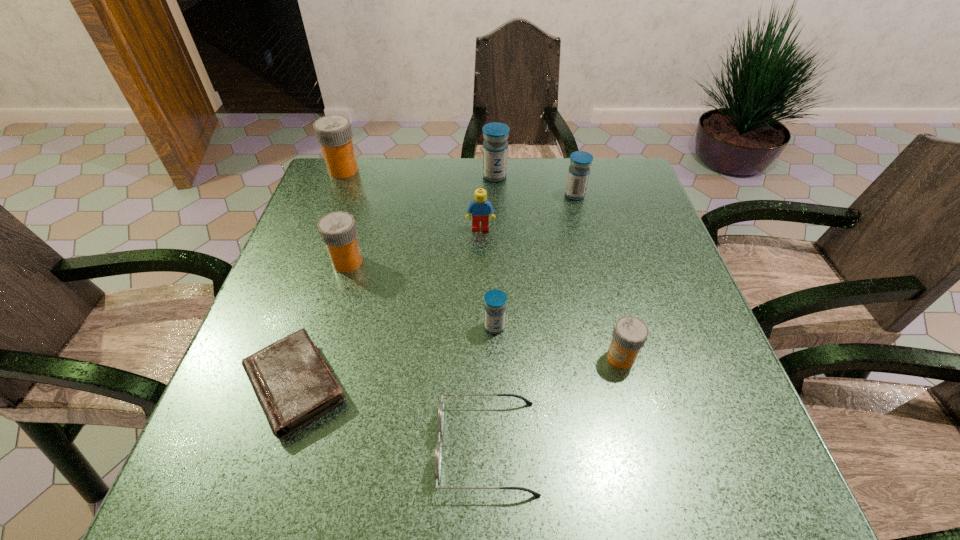
The width and height of the screenshot is (960, 540). What are the coordinates of `the farthest orange medicine` in the screenshot? It's located at (334, 133).

Image resolution: width=960 pixels, height=540 pixels. I want to click on the leftmost medicine, so click(x=334, y=133).

I want to click on the farthest blue medicine, so click(495, 146).

Where is `the second orange medicine from left to right`? The height and width of the screenshot is (540, 960). the second orange medicine from left to right is located at coordinates (338, 231).

In order to click on the third nearest medicine in this screenshot , I will do coord(338,231).

Where is `the rightmost blue medicine`? Image resolution: width=960 pixels, height=540 pixels. the rightmost blue medicine is located at coordinates (578, 174).

At what (x,y) coordinates should I click in order to perform the action: click on the fourth nearest medicine. Please return your answer as a coordinate pair (x, y). Image resolution: width=960 pixels, height=540 pixels. Looking at the image, I should click on (578, 174).

The height and width of the screenshot is (540, 960). Identify the location of blue Lego. (479, 209).

You are a GUI agent. You are given a task and a screenshot of the screen. Output one action in this format:
    pyautogui.click(x=<x>, y=<y>)
    Task: Click on the Lego
    
    Given the screenshot: What is the action you would take?
    pyautogui.click(x=479, y=209)

Locate an element on the screen. the smallest orange medicine is located at coordinates 630,333.